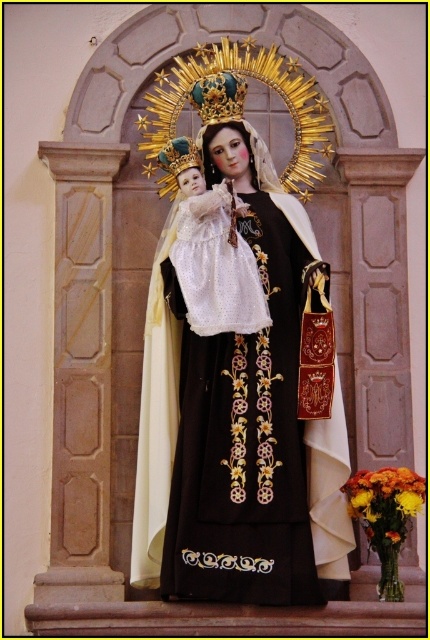
You are an art student analyzing the composition of the image. The statue of the Virgin Mary is positioned in a niche. You need to determine the exact central point of the black satin dress at center to ensure proper alignment in your sketch. What are the coordinates of its center?

The coordinates of the center of the black satin dress at center are at point (x=243, y=442).

Consider the image. You are an art conservator assessing the spatial arrangement of the statue. Which object, the black satin dress at center or the gold metallic crown at upper center, occupies a smaller horizontal space in the image?

The black satin dress at center has a lesser width compared to the gold metallic crown at upper center, so the black satin dress at center occupies a smaller horizontal space.